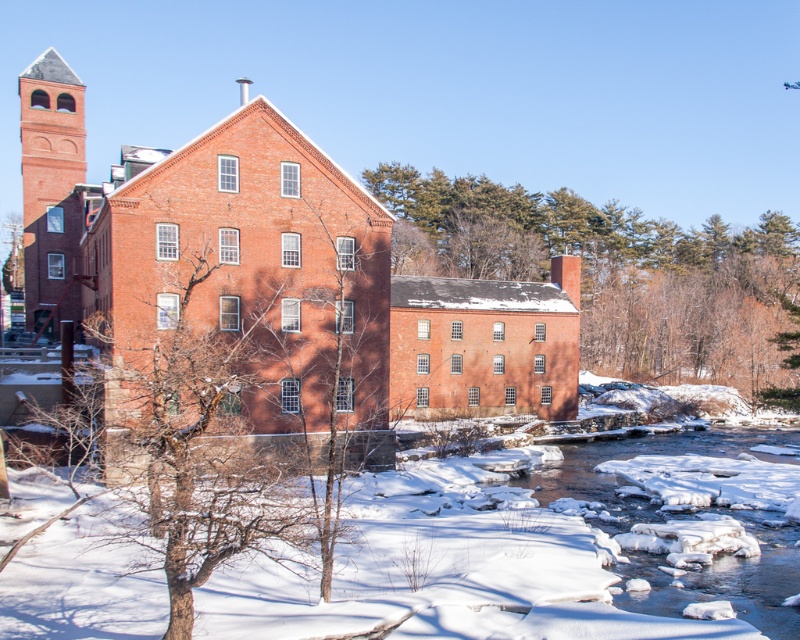
You are standing in the winter scene and want to take a photo of the brick building at center and the smooth brown tree trunk at center. Which object appears closer to the camera in the image?

The smooth brown tree trunk at center appears closer to the camera because it is positioned over the brick building at center, indicating it is in a lower layer of the image.

Based on the photo, you are standing in the winter scene and want to take a photo of the brick building at center. To ensure the building is centered in your photo, where should you position your camera relative to the scene?

To center the brick building at center in your photo, position your camera directly in line with the building, aligning it with the coordinates point (274, 282) provided in the scene.